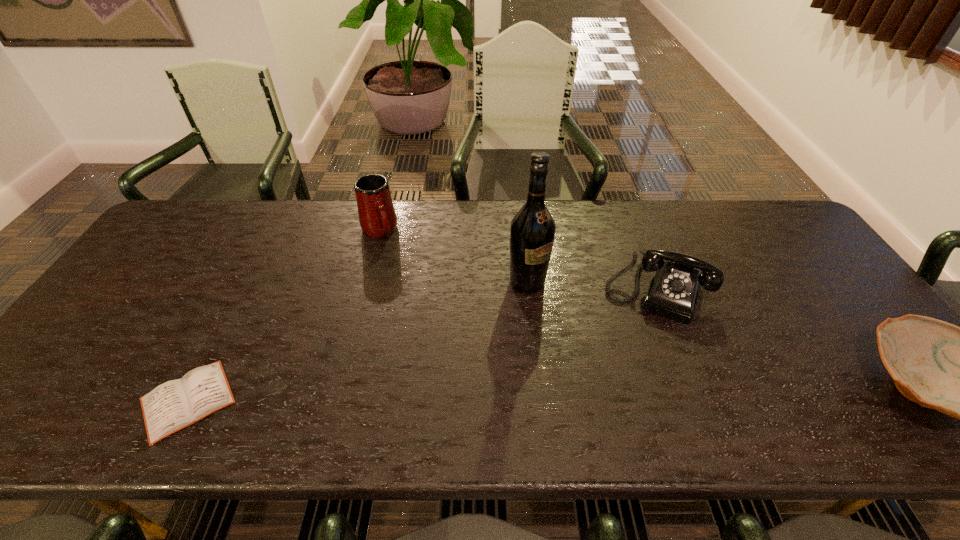
I want to click on vacant region located 0.220m on the dial of the fourth object from left to right, so click(x=622, y=390).

The width and height of the screenshot is (960, 540). Find the location of `free spot located 0.100m on the dial of the fourth object from left to right`. free spot located 0.100m on the dial of the fourth object from left to right is located at coordinates (635, 350).

At what (x,y) coordinates should I click in order to perform the action: click on vacant space situated on the label of the wine bottle. Please return your answer as a coordinate pair (x, y). Looking at the image, I should click on (619, 370).

At what (x,y) coordinates should I click in order to perform the action: click on free region located on the label of the wine bottle. Please return your answer as a coordinate pair (x, y). Looking at the image, I should click on (598, 349).

At what (x,y) coordinates should I click in order to perform the action: click on vacant space located on the label of the wine bottle. Please return your answer as a coordinate pair (x, y). The width and height of the screenshot is (960, 540). Looking at the image, I should click on (564, 318).

The image size is (960, 540). In order to click on free space located on the side of the mug with the handle in this screenshot , I will do `click(429, 323)`.

Image resolution: width=960 pixels, height=540 pixels. Identify the location of free space located 0.100m on the side of the mug with the handle. (396, 264).

Identify the location of vacant position located on the side of the mug with the handle. The width and height of the screenshot is (960, 540). (423, 313).

The width and height of the screenshot is (960, 540). What are the coordinates of `object located in the far edge section of the desktop` in the screenshot? It's located at (377, 217).

Locate an element on the screen. The image size is (960, 540). object that is at the near edge is located at coordinates (176, 404).